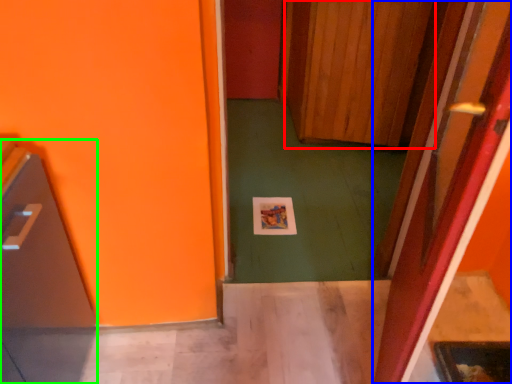
Question: Which is farther away from door (highlighted by a red box)? door (highlighted by a blue box) or appliance (highlighted by a green box)?

Choices:
 (A) door
 (B) appliance

Answer: (B)